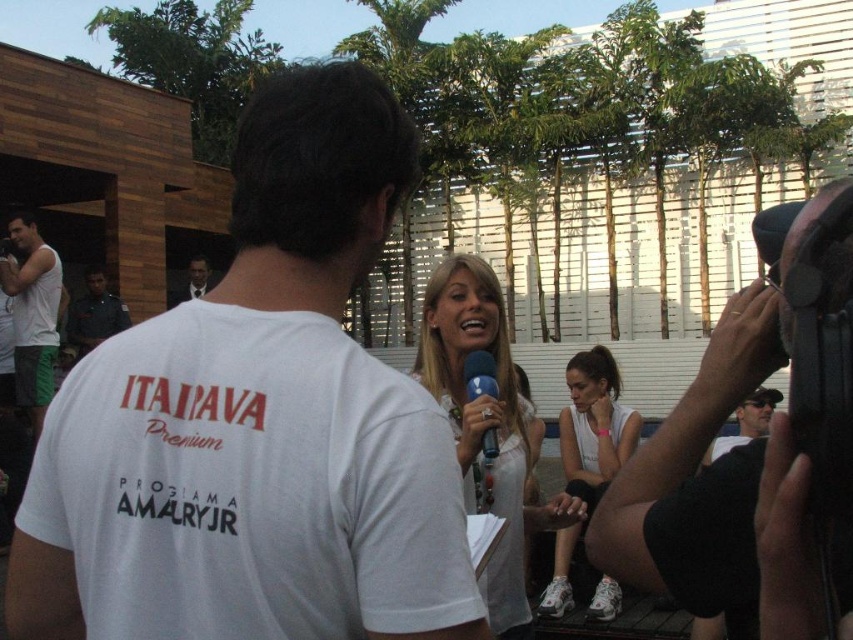
You are a photographer trying to set up equipment for a photo shoot. You have a black matte camera at upper right and a smooth black suit at center. Which object is narrower?

The black matte camera at upper right has a lesser width compared to the smooth black suit at center, so the black matte camera at upper right is narrower.

You are a photographer who needs to carry both the black matte camera at upper right and the smooth black suit at center to a nearby location. Which item should you prioritize packing first if you want to maximize space in your bag?

The black matte camera at upper right occupies less space than the smooth black suit at center, so you should pack the smooth black suit at center first to save more space for the smaller item.